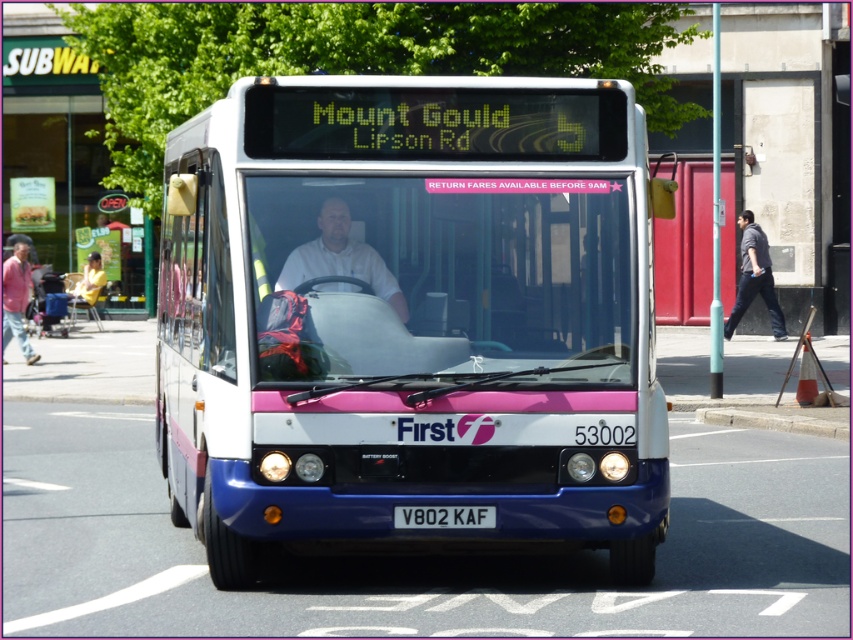
Which of these two, matte white bus at center or gray concrete curb at lower center, stands taller?

matte white bus at center

Is point (222, 362) closer to camera compared to point (839, 435)?

Yes, it is.

You are a GUI agent. You are given a task and a screenshot of the screen. Output one action in this format:
    pyautogui.click(x=<x>, y=<y>)
    Task: Click on the matte white bus at center
    
    Given the screenshot: What is the action you would take?
    pyautogui.click(x=410, y=316)

Can you confirm if matte pink jacket at left is bigger than white rectangular license plate at center?

Yes, matte pink jacket at left is bigger than white rectangular license plate at center.

Is point (28, 264) farther from camera compared to point (398, 516)?

Yes, it is behind point (398, 516).

The height and width of the screenshot is (640, 853). I want to click on matte pink jacket at left, so click(16, 296).

Is white matte shirt at center wider than dark gray shirt at right?

Incorrect, white matte shirt at center's width does not surpass dark gray shirt at right's.

Is white matte shirt at center positioned before dark gray shirt at right?

Yes, it is in front of dark gray shirt at right.

Between point (347, 205) and point (741, 294), which one is positioned in front?

Point (347, 205) is in front.

I want to click on white matte shirt at center, so click(340, 259).